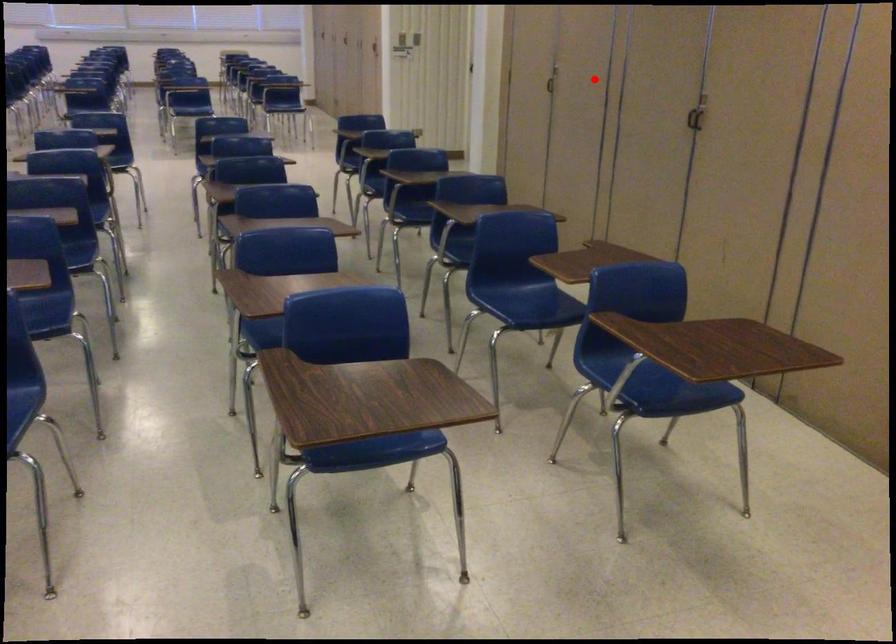
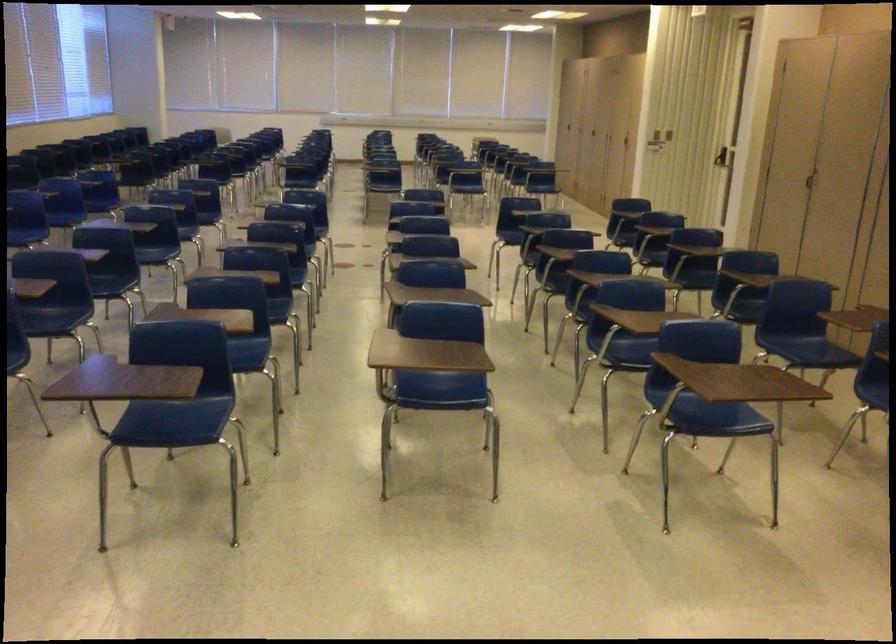
Question: I am providing you with two images of the same scene from different viewpoints. A red point is shown in image1. For the corresponding object point in image2, is it positioned nearer or farther from the camera?

Choices:
 (A) Nearer
 (B) Farther

Answer: (B)